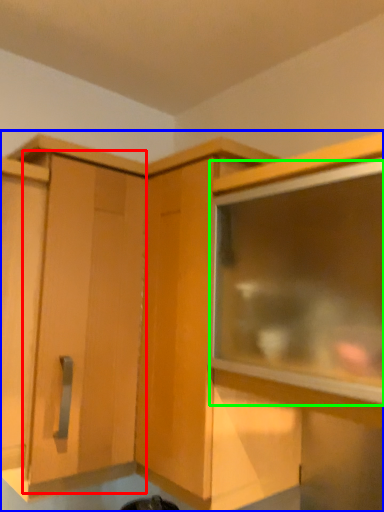
Question: Which object is the closest to the cabinetry (highlighted by a red box)? Choose among these: cabinetry (highlighted by a blue box) or window (highlighted by a green box).

Choices:
 (A) cabinetry
 (B) window

Answer: (A)